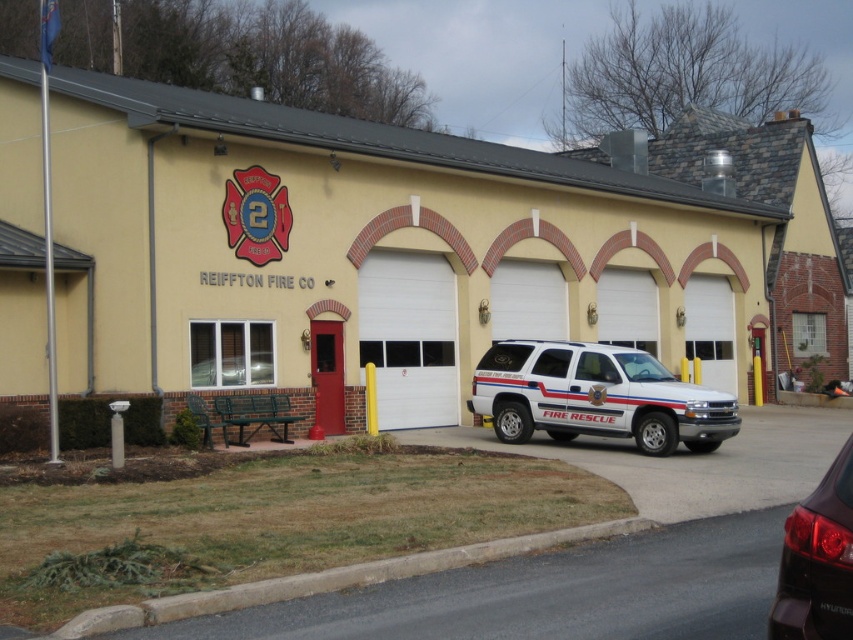
Which is in front, point (634, 404) or point (833, 609)?

Positioned in front is point (833, 609).

Does white matte fire rescue vehicle at center come in front of shiny black suv at lower right?

No.

Which is behind, point (612, 404) or point (824, 630)?

Positioned behind is point (612, 404).

This screenshot has height=640, width=853. Find the location of `white matte fire rescue vehicle at center`. white matte fire rescue vehicle at center is located at coordinates (596, 396).